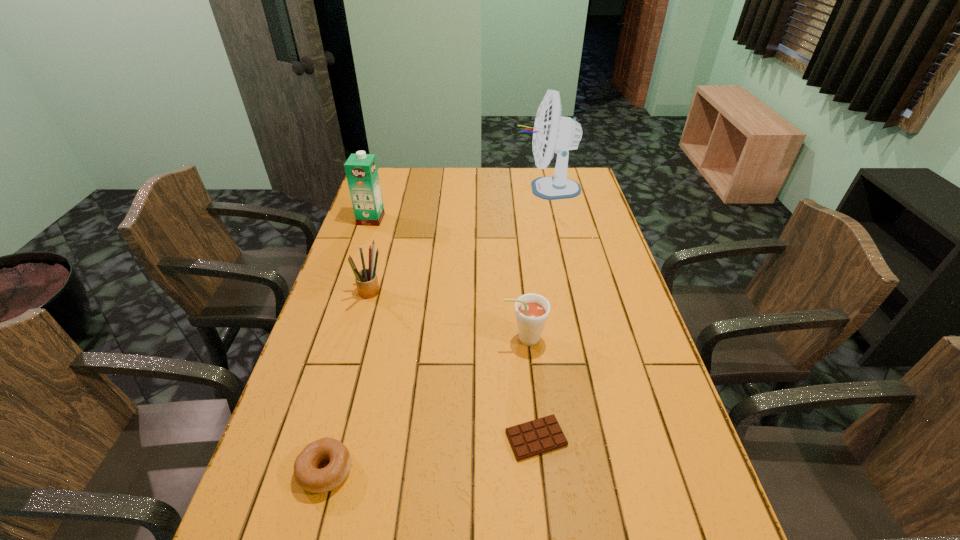
Where is `free space located 0.080m on the grille of the tallest object`? The height and width of the screenshot is (540, 960). free space located 0.080m on the grille of the tallest object is located at coordinates (493, 188).

Image resolution: width=960 pixels, height=540 pixels. I want to click on free space located 0.140m on the right of the fifth nearest object, so click(x=420, y=219).

You are a GUI agent. You are given a task and a screenshot of the screen. Output one action in this format:
    pyautogui.click(x=<x>, y=<y>)
    Task: Click on the vacant point located 0.360m on the drink side of the fourth farthest object
    
    Given the screenshot: What is the action you would take?
    pyautogui.click(x=371, y=339)

This screenshot has height=540, width=960. I want to click on vacant space located 0.160m on the drink side of the fourth farthest object, so click(444, 339).

Locate an element on the screen. This screenshot has height=540, width=960. free space located 0.120m on the drink side of the fourth farthest object is located at coordinates (458, 339).

Find the location of a particular element. This screenshot has height=540, width=960. vacant space situated on the right of the pencil box is located at coordinates (447, 293).

Locate an element on the screen. The image size is (960, 540). blank space located on the right of the bagel is located at coordinates (390, 470).

You are a GUI agent. You are given a task and a screenshot of the screen. Output one action in this format:
    pyautogui.click(x=<x>, y=<y>)
    Task: Click on the vacant space located 0.130m on the front of the shortest object
    The width and height of the screenshot is (960, 540).
    Given the screenshot: What is the action you would take?
    pyautogui.click(x=545, y=527)

Where is `object that is at the far edge`? object that is at the far edge is located at coordinates (552, 132).

Locate an element on the screen. The height and width of the screenshot is (540, 960). carton at the left edge is located at coordinates (361, 170).